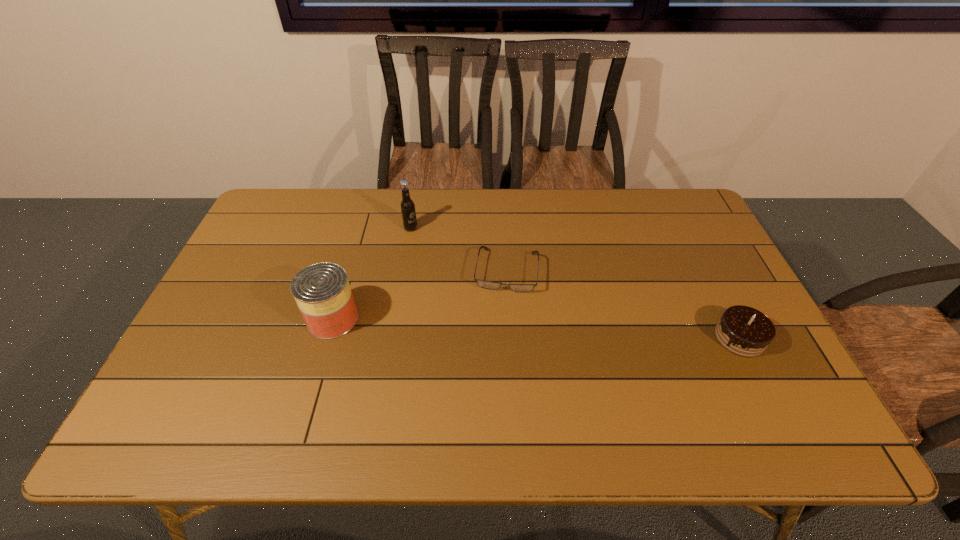
The image size is (960, 540). What are the coordinates of `the leftmost object` in the screenshot? It's located at (322, 292).

Locate an element on the screen. The height and width of the screenshot is (540, 960). the second tallest object is located at coordinates (322, 292).

The height and width of the screenshot is (540, 960). Identify the location of the second shortest object. (744, 331).

Locate an element on the screen. The width and height of the screenshot is (960, 540). the rightmost object is located at coordinates (744, 331).

Locate an element on the screen. spectacles is located at coordinates (481, 283).

The image size is (960, 540). What are the coordinates of `the second farthest object` in the screenshot? It's located at (481, 283).

Where is `root beer`? root beer is located at coordinates (407, 206).

Image resolution: width=960 pixels, height=540 pixels. I want to click on the tallest object, so click(407, 206).

You are a GUI agent. You are given a task and a screenshot of the screen. Output one action in this format:
    pyautogui.click(x=<x>, y=<y>)
    Task: Click on the vacant region located on the back of the can
    
    Given the screenshot: What is the action you would take?
    360,226

Locate an element on the screen. free spot located 0.370m on the left of the rightmost object is located at coordinates (572, 338).